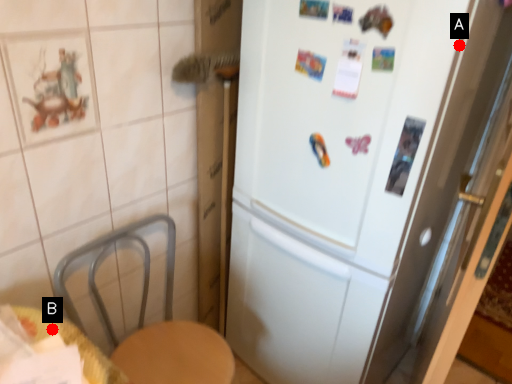
Question: Two points are circled on the image, labeled by A and B beside each circle. Which point is farther from the camera taking this photo?

Choices:
 (A) A is further
 (B) B is further

Answer: (B)